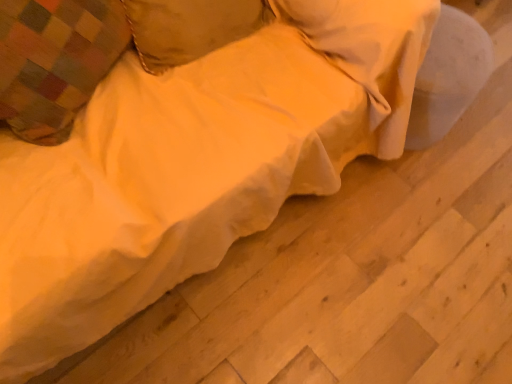
Question: Which is correct: soft yellow fabric pillow at upper center, the second pillow positioned from the left, is inside plaid fabric pillow at upper left, the 2th pillow when ordered from right to left, or outside of it?

Choices:
 (A) outside
 (B) inside

Answer: (A)

Question: In the image, is soft yellow fabric pillow at upper center, the second pillow positioned from the left, on the left side or the right side of plaid fabric pillow at upper left, placed as the first pillow when sorted from left to right?

Choices:
 (A) right
 (B) left

Answer: (A)

Question: Considering the positions of soft yellow fabric pillow at upper center, arranged as the first pillow when viewed from the right, and plaid fabric pillow at upper left, placed as the first pillow when sorted from left to right, in the image, is soft yellow fabric pillow at upper center, arranged as the first pillow when viewed from the right, wider or thinner than plaid fabric pillow at upper left, placed as the first pillow when sorted from left to right,?

Choices:
 (A) thin
 (B) wide

Answer: (A)

Question: Considering the positions of plaid fabric pillow at upper left, placed as the first pillow when sorted from left to right, and soft yellow fabric pillow at upper center, arranged as the first pillow when viewed from the right, in the image, is plaid fabric pillow at upper left, placed as the first pillow when sorted from left to right, taller or shorter than soft yellow fabric pillow at upper center, arranged as the first pillow when viewed from the right,?

Choices:
 (A) short
 (B) tall

Answer: (B)

Question: From the image's perspective, is plaid fabric pillow at upper left, the 2th pillow when ordered from right to left, located above or below soft yellow fabric pillow at upper center, the second pillow positioned from the left?

Choices:
 (A) above
 (B) below

Answer: (B)

Question: Is point (3, 56) closer or farther from the camera than point (236, 29)?

Choices:
 (A) closer
 (B) farther

Answer: (A)

Question: From a real-world perspective, relative to soft yellow fabric pillow at upper center, the second pillow positioned from the left, is plaid fabric pillow at upper left, placed as the first pillow when sorted from left to right, vertically above or below?

Choices:
 (A) below
 (B) above

Answer: (B)